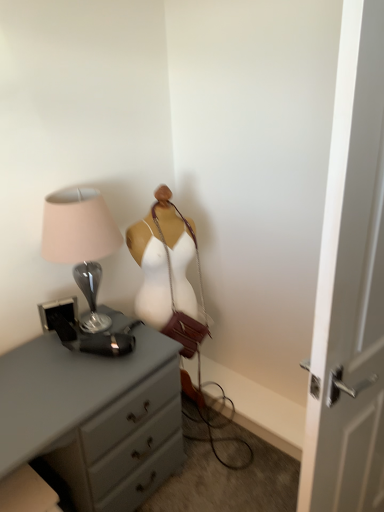
At what (x,y) coordinates should I click in order to perform the action: click on free space in front of white fabric mannequin at center. Please return your answer as a coordinate pair (x, y). The width and height of the screenshot is (384, 512). Looking at the image, I should click on (x=199, y=452).